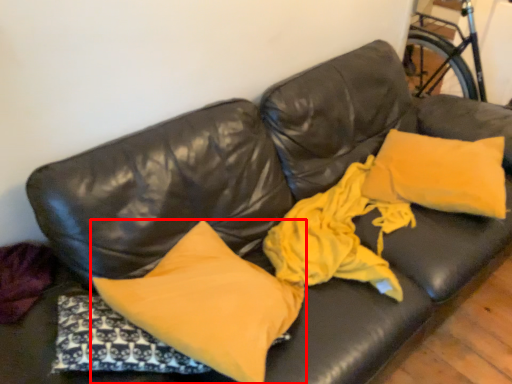
Question: From the image's perspective, what is the correct spatial positioning of pillow (annotated by the red box) in reference to pillow?

Choices:
 (A) above
 (B) below

Answer: (B)